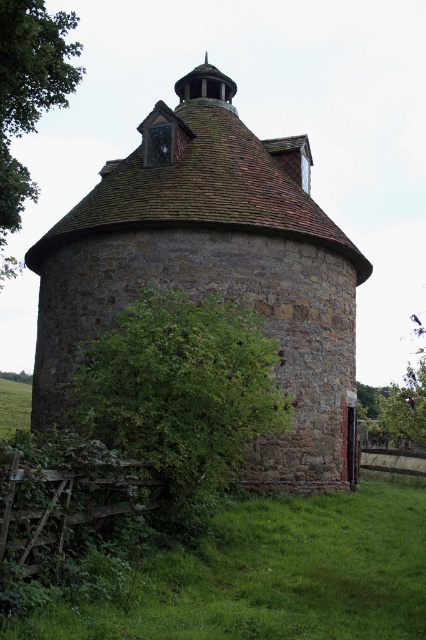
Does green leafy bush at lower left appear on the left side of green leafy tree at left?

In fact, green leafy bush at lower left is to the right of green leafy tree at left.

Locate an element on the screen. The width and height of the screenshot is (426, 640). green leafy bush at lower left is located at coordinates (181, 390).

Does brown stone silo at center have a greater height compared to green leafy tree at left?

No, brown stone silo at center is not taller than green leafy tree at left.

Does brown stone silo at center appear under green leafy tree at left?

Yes.

The height and width of the screenshot is (640, 426). I want to click on brown stone silo at center, so click(x=213, y=268).

Is brown stone silo at center bigger than green leafy bush at lower left?

Yes, brown stone silo at center is bigger than green leafy bush at lower left.

Is point (77, 218) positioned before point (224, 392)?

No, it is not.

The height and width of the screenshot is (640, 426). In order to click on brown stone silo at center in this screenshot , I will do [x=213, y=268].